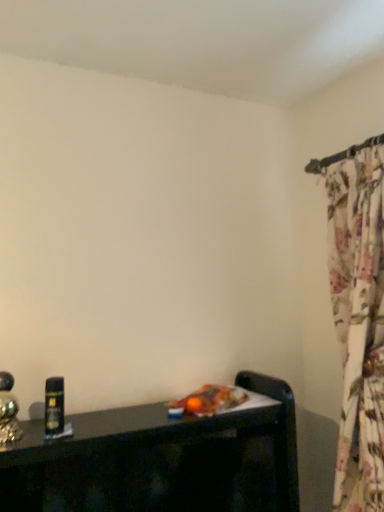
The height and width of the screenshot is (512, 384). Identify the location of black plastic can at left. (54, 407).

Image resolution: width=384 pixels, height=512 pixels. What do you see at coordinates (54, 407) in the screenshot?
I see `black plastic can at left` at bounding box center [54, 407].

Where is `black plastic can at left`? Image resolution: width=384 pixels, height=512 pixels. black plastic can at left is located at coordinates (54, 407).